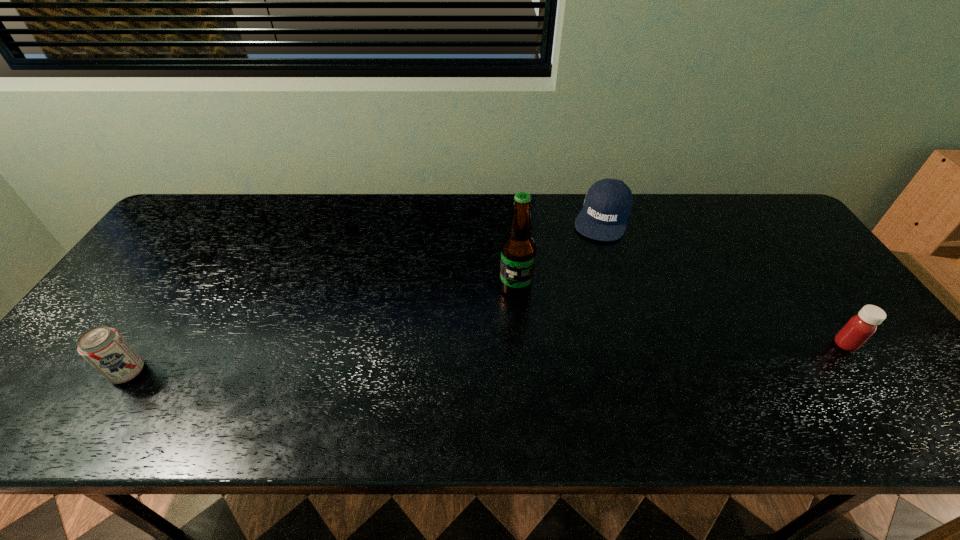
This screenshot has height=540, width=960. Find the location of `vacant area situated on the label of the tallest object`. vacant area situated on the label of the tallest object is located at coordinates (427, 387).

The width and height of the screenshot is (960, 540). I want to click on vacant space located on the label of the tallest object, so 486,321.

At what (x,y) coordinates should I click in order to perform the action: click on vacant space located 0.060m on the label of the tallest object. Please return your answer as a coordinate pair (x, y). This screenshot has height=540, width=960. Looking at the image, I should click on (494, 312).

The width and height of the screenshot is (960, 540). Find the location of `vacant space situated on the front-facing side of the third object from left to right`. vacant space situated on the front-facing side of the third object from left to right is located at coordinates (588, 266).

The height and width of the screenshot is (540, 960). I want to click on vacant space situated on the front-facing side of the third object from left to right, so click(x=590, y=258).

At what (x,y) coordinates should I click in order to perform the action: click on free location located on the front-facing side of the third object from left to right. Please return your answer as a coordinate pair (x, y). Looking at the image, I should click on (591, 255).

Locate an element on the screen. object at the far edge is located at coordinates (607, 206).

The height and width of the screenshot is (540, 960). I want to click on object positioned at the near edge, so click(105, 349).

You are a GUI agent. You are given a task and a screenshot of the screen. Output one action in this format:
    pyautogui.click(x=<x>, y=<y>)
    Task: Click on the object positioned at the left edge
    This screenshot has height=540, width=960.
    Given the screenshot: What is the action you would take?
    pyautogui.click(x=105, y=349)

Where is `object that is positioned at the right edge`? object that is positioned at the right edge is located at coordinates (861, 327).